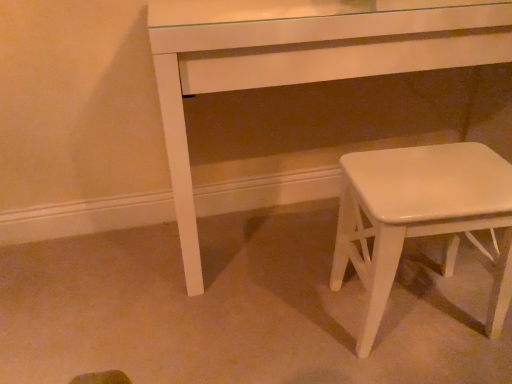
Question: Do you think white glossy stool at lower right is within white glossy table at center, or outside of it?

Choices:
 (A) inside
 (B) outside

Answer: (B)

Question: Visually, is white glossy stool at lower right positioned to the left or to the right of white glossy table at center?

Choices:
 (A) right
 (B) left

Answer: (A)

Question: From the image's perspective, relative to white glossy table at center, is white glossy stool at lower right above or below?

Choices:
 (A) above
 (B) below

Answer: (B)

Question: Would you say white glossy table at center is inside or outside white glossy stool at lower right?

Choices:
 (A) inside
 (B) outside

Answer: (B)

Question: Is point (188, 256) closer or farther from the camera than point (387, 150)?

Choices:
 (A) closer
 (B) farther

Answer: (B)

Question: From a real-world perspective, is white glossy table at center physically located above or below white glossy stool at lower right?

Choices:
 (A) below
 (B) above

Answer: (B)

Question: Considering the relative positions of white glossy table at center and white glossy stool at lower right in the image provided, is white glossy table at center to the left or to the right of white glossy stool at lower right?

Choices:
 (A) left
 (B) right

Answer: (A)